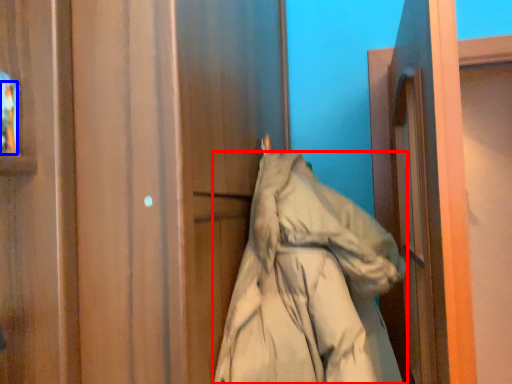
Question: Which object is further to the camera taking this photo, coat (highlighted by a red box) or person (highlighted by a blue box)?

Choices:
 (A) coat
 (B) person

Answer: (B)